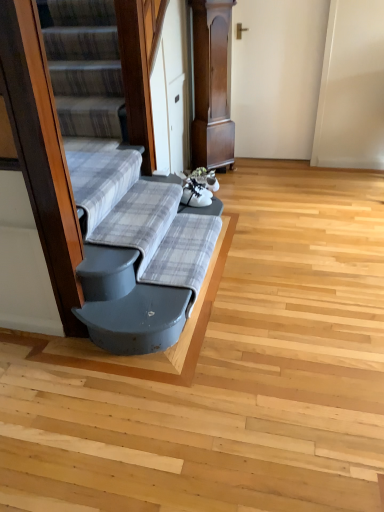
Question: In the image, is gray plaid fabric at lower left, the 2th sheet from the left, on the left side or the right side of plaid fabric couch at center, arranged as the second sheet when viewed from the right?

Choices:
 (A) right
 (B) left

Answer: (A)

Question: Looking at their shapes, would you say gray plaid fabric at lower left, the 2th sheet from the left, is wider or thinner than plaid fabric couch at center, arranged as the second sheet when viewed from the right?

Choices:
 (A) wide
 (B) thin

Answer: (A)

Question: From their relative heights in the image, would you say gray plaid fabric at lower left, which appears as the first sheet when viewed from the right, is taller or shorter than plaid fabric couch at center, arranged as the second sheet when viewed from the right?

Choices:
 (A) short
 (B) tall

Answer: (A)

Question: Is plaid fabric couch at center, arranged as the second sheet when viewed from the right, taller or shorter than gray plaid fabric at lower left, the 2th sheet from the left?

Choices:
 (A) tall
 (B) short

Answer: (A)

Question: From the image's perspective, is plaid fabric couch at center, arranged as the second sheet when viewed from the right, located above or below gray plaid fabric at lower left, the 2th sheet from the left?

Choices:
 (A) below
 (B) above

Answer: (B)

Question: Does point (122, 198) appear closer or farther from the camera than point (198, 234)?

Choices:
 (A) farther
 (B) closer

Answer: (B)

Question: Is plaid fabric couch at center, arranged as the second sheet when viewed from the right, spatially inside gray plaid fabric at lower left, which appears as the first sheet when viewed from the right, or outside of it?

Choices:
 (A) outside
 (B) inside

Answer: (A)